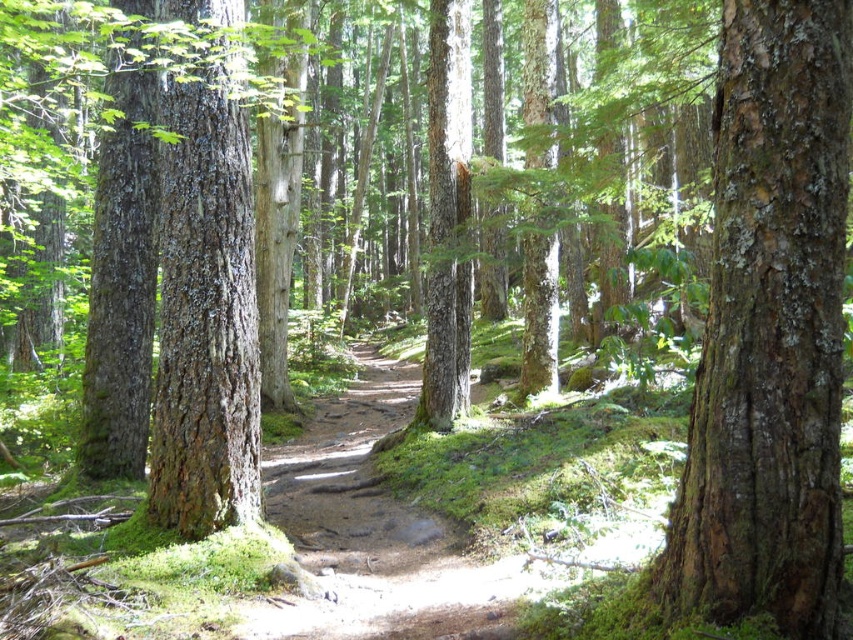
You are a hiker trying to identify landmarks in the forest. You notice two objects labeled as smooth brown bark at center and smooth brown bark tree at center. Which of these two is larger in size?

The smooth brown bark tree at center is larger in size than the smooth brown bark at center because it occupies more space.

You are a hiker trying to navigate through the forest. You see two objects in front of you, the smooth brown bark at center and the smooth brown bark tree at center. Which one is closer to you?

The smooth brown bark at center is closer to you because it is in front of the smooth brown bark tree at center.

You are a hiker trying to navigate through the forest. You see two trees with smooth brown bark. One is labeled as smooth brown bark at center and the other as smooth brown bark tree at center. Which one is more to the right?

The smooth brown bark at center is positioned on the right side of the smooth brown bark tree at center, so it is more to the right.